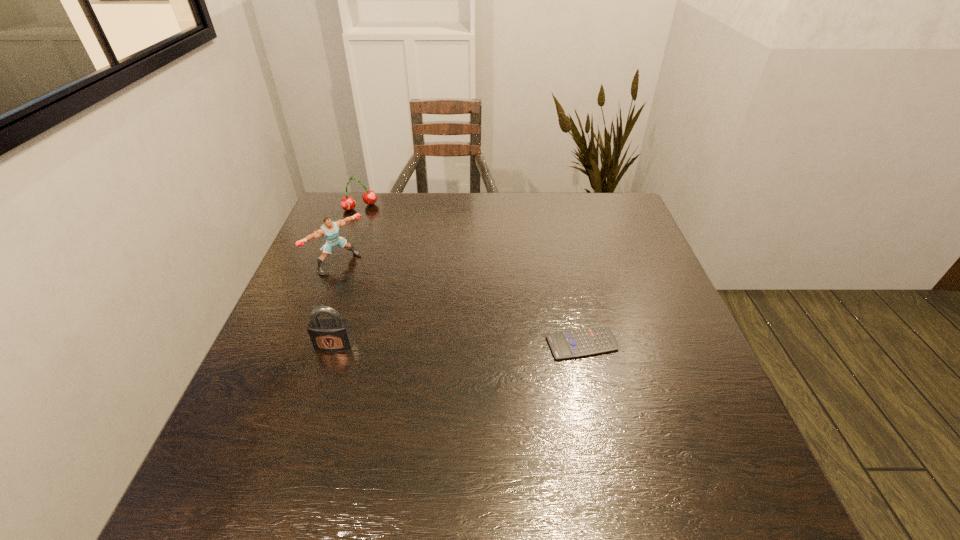
At what (x,y) coordinates should I click in order to perform the action: click on blank region between the padlock and the cherry. Please return your answer as a coordinate pair (x, y). The image size is (960, 540). Looking at the image, I should click on (348, 276).

Find the location of a particular element. This screenshot has width=960, height=540. vacant space that's between the farthest object and the padlock is located at coordinates (348, 276).

Locate an element on the screen. free point between the padlock and the puncher is located at coordinates (336, 303).

Find the location of a particular element. The image size is (960, 540). vacant point located between the cherry and the tallest object is located at coordinates (349, 235).

Identify the location of empty space between the puncher and the padlock. The image size is (960, 540). (336, 303).

I want to click on empty space that is in between the shortest object and the padlock, so click(458, 344).

You are a GUI agent. You are given a task and a screenshot of the screen. Output one action in this format:
    pyautogui.click(x=<x>, y=<y>)
    Task: Click on the object that is the closest one to the second farthest object
    
    Given the screenshot: What is the action you would take?
    pyautogui.click(x=348, y=203)

This screenshot has width=960, height=540. Identify the location of object that is the closest to the third nearest object. (348, 203).